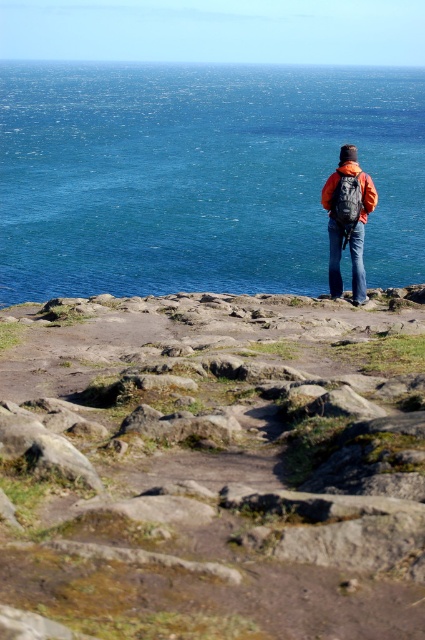
What do you see at coordinates (200, 177) in the screenshot?
I see `blue water at center` at bounding box center [200, 177].

Between point (235, 289) and point (325, 184), which one is positioned in front?

Point (325, 184)

Measure the distance between blue water at center and camera.

14.18 meters

This screenshot has width=425, height=640. Identify the location of blue water at center. (200, 177).

Does orange fabric backpack at center appear over matte orange jacket at center?

Actually, orange fabric backpack at center is below matte orange jacket at center.

Which is behind, point (351, 176) or point (367, 195)?

The point (367, 195) is behind.

The width and height of the screenshot is (425, 640). I want to click on orange fabric backpack at center, so click(348, 221).

Who is shorter, rough stone path at center or blue water at center?

rough stone path at center is shorter.

Between point (130, 630) and point (14, 129), which one is positioned in front?

Point (130, 630)

Who is more forward, (209, 426) or (289, 275)?

Point (209, 426) is more forward.

Find the location of a particular element. rough stone path at center is located at coordinates (212, 468).